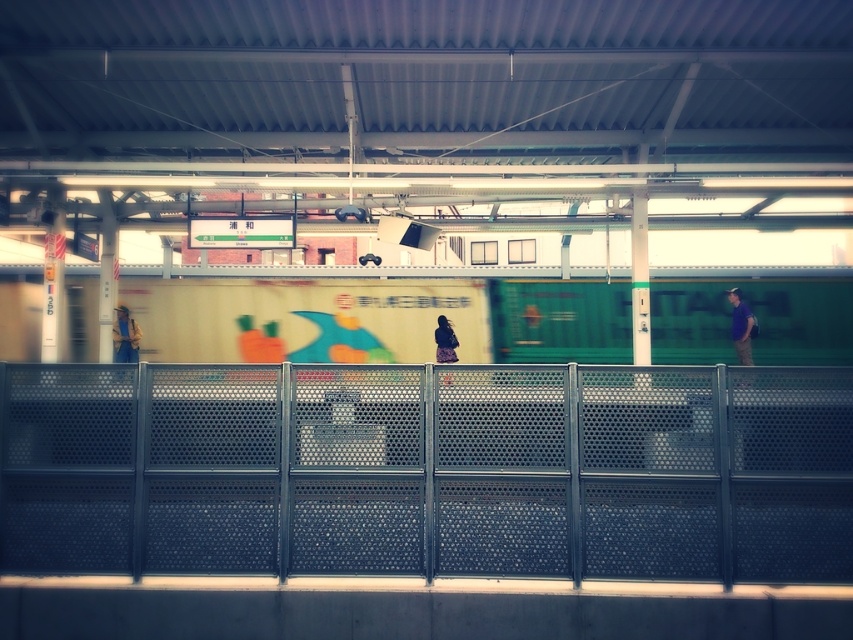
From the picture: You are standing at the train station platform and want to know how far the green matte train at center is from you. Can you determine the distance?

The green matte train at center is 23.41 meters away from the viewer.

You are waiting at the train station and see a purple fabric shirt at right and a denim jacket at left. Which clothing item is positioned higher relative to the other?

The purple fabric shirt at right is located above the denim jacket at left, so it is positioned higher.

You are standing at the train station platform and see a purple fabric shirt at right. If you want to take a photo of it with your phone, which has a maximum zoom range of 10 feet, will you be able to capture it clearly without moving closer?

The purple fabric shirt at right is 72.18 feet from the camera, which is much farther than the phone camera maximum zoom range of 10 feet. Therefore, you won wait be able to capture it clearly without moving closer.